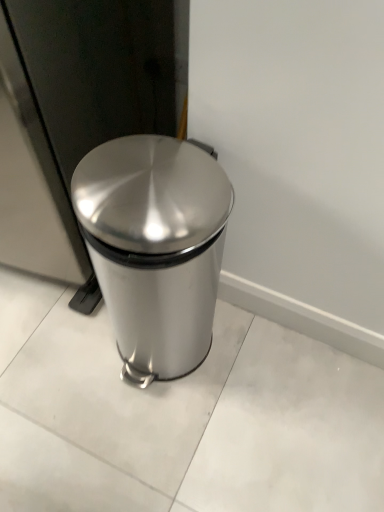
You are a GUI agent. You are given a task and a screenshot of the screen. Output one action in this format:
    pyautogui.click(x=<x>, y=<y>)
    Task: Click on the blank space situated above satin silver trash can at center (from a real-world perspective)
    The height and width of the screenshot is (512, 384).
    Given the screenshot: What is the action you would take?
    pyautogui.click(x=136, y=182)